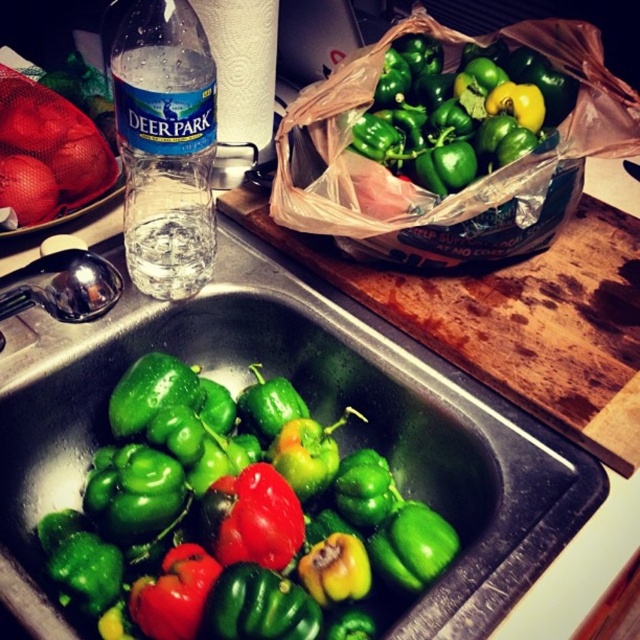
You are organizing items in the kitchen and need to place a 5.5 inch wide bowl between the green matte peppers at lower left and the transparent plastic water bottle at left. Can the bowl fit in the space between them?

The distance between the green matte peppers at lower left and the transparent plastic water bottle at left is 6.17 inches. Since the bowl is 5.5 inches wide, it can fit in the space between them as the available space is wider than the bowl.

You are organizing the kitchen and need to place the green matte peppers at lower left and the transparent plastic water bottle at left. According to their positions, which item is closer to the sink?

The green matte peppers at lower left are closer to the sink because they are positioned below the transparent plastic water bottle at left, which is further away from the sink.